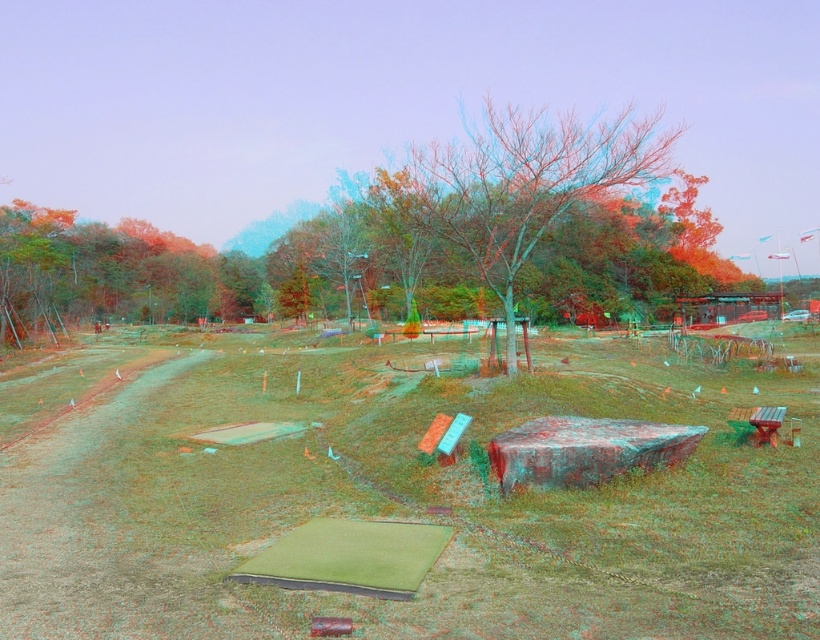
Does green grass at center appear under wooden bench at lower right?

No, green grass at center is not below wooden bench at lower right.

From the picture: Can you confirm if green grass at center is thinner than wooden bench at lower right?

No.

What are the coordinates of `green grass at center` in the screenshot? It's located at (395, 493).

Locate an element on the screen. green grass at center is located at coordinates (395, 493).

Does bare wood tree at center have a smaller size compared to wooden bench at lower right?

No, bare wood tree at center is not smaller than wooden bench at lower right.

Based on the photo, which of these two, bare wood tree at center or wooden bench at lower right, stands shorter?

wooden bench at lower right

Where is `bare wood tree at center`? bare wood tree at center is located at coordinates (522, 182).

Is green grass at center closer to the viewer compared to bare wood tree at center?

Yes, green grass at center is in front of bare wood tree at center.

Does green grass at center have a smaller size compared to bare wood tree at center?

Yes.

Between point (673, 387) and point (476, 150), which one is positioned in front?

Point (476, 150) is in front.

This screenshot has height=640, width=820. In order to click on green grass at center in this screenshot , I will do `click(395, 493)`.